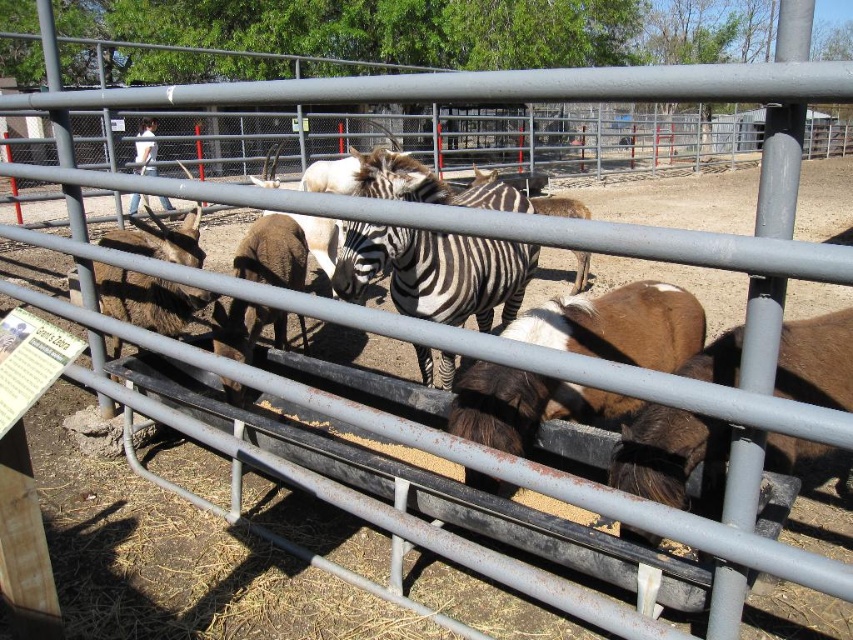
Question: Among these points, which one is nearest to the camera?

Choices:
 (A) (569, 301)
 (B) (431, 250)

Answer: (A)

Question: From the image, what is the correct spatial relationship of brown fuzzy goat at center in relation to black and white striped zebra at center?

Choices:
 (A) right
 (B) left

Answer: (A)

Question: Considering the relative positions of brown fuzzy goat at center and black and white striped zebra at center in the image provided, where is brown fuzzy goat at center located with respect to black and white striped zebra at center?

Choices:
 (A) right
 (B) left

Answer: (A)

Question: Which point is closer to the camera?

Choices:
 (A) black and white striped zebra at center
 (B) brown fuzzy goat at center

Answer: (A)

Question: Observing the image, what is the correct spatial positioning of brown fuzzy goat at center in reference to black and white striped zebra at center?

Choices:
 (A) below
 (B) above

Answer: (A)

Question: Which of the following is the closest to the observer?

Choices:
 (A) brown fuzzy goat at center
 (B) black and white striped zebra at center

Answer: (B)